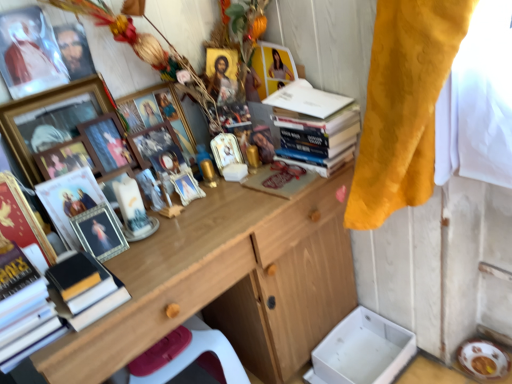
Describe the element at coordinates (280, 179) in the screenshot. I see `matte brown book at center, arranged as the first magazine when viewed from the right` at that location.

The width and height of the screenshot is (512, 384). I want to click on hardcover book at left, which is the 1th book in bottom-to-top order, so click(x=83, y=289).

How much space does metallic gold picture frame at upper left, which appears as the 7th picture frame when viewed from the right, occupy horizontally?

metallic gold picture frame at upper left, which appears as the 7th picture frame when viewed from the right, is 3.09 inches in width.

What do you see at coordinates (64, 159) in the screenshot? I see `metallic gold picture frame at upper left, which appears as the 7th picture frame when viewed from the right` at bounding box center [64, 159].

Image resolution: width=512 pixels, height=384 pixels. What do you see at coordinates (52, 118) in the screenshot?
I see `gold-framed picture at upper left, the 2th picture frame in the left-to-right sequence` at bounding box center [52, 118].

At what (x,y) coordinates should I click in order to perform the action: click on metallic gold picture frame at center, which is counted as the ninth picture frame, starting from the left. Please return your answer as a coordinate pair (x, y). Image resolution: width=512 pixels, height=384 pixels. Looking at the image, I should click on (225, 150).

Find the location of a particular element. matte gold picture frame at left, the first magazine when ordered from left to right is located at coordinates (70, 201).

Where is `matte brown book at center, the second magazine positioned from the left`? The width and height of the screenshot is (512, 384). matte brown book at center, the second magazine positioned from the left is located at coordinates (280, 179).

From a real-world perspective, does metallic gold picture frame at center, which is counted as the ninth picture frame, starting from the left, sit lower than matte brown book at center, the second magazine positioned from the left?

No.

Based on the photo, can you confirm if metallic gold picture frame at center, the first picture frame positioned from the right, is smaller than matte brown book at center, the second magazine positioned from the left?

Actually, metallic gold picture frame at center, the first picture frame positioned from the right, might be larger than matte brown book at center, the second magazine positioned from the left.

Considering the relative sizes of metallic gold picture frame at center, which is counted as the ninth picture frame, starting from the left, and matte brown book at center, arranged as the first magazine when viewed from the right, in the image provided, is metallic gold picture frame at center, which is counted as the ninth picture frame, starting from the left, taller than matte brown book at center, arranged as the first magazine when viewed from the right,?

Yes, metallic gold picture frame at center, which is counted as the ninth picture frame, starting from the left, is taller than matte brown book at center, arranged as the first magazine when viewed from the right.

Which of these two, silver metallic picture frame at center-left, the 5th picture frame when ordered from left to right, or matte brown book at center, arranged as the first magazine when viewed from the right, is smaller?

matte brown book at center, arranged as the first magazine when viewed from the right.

Considering the positions of objects silver metallic picture frame at center-left, which is counted as the fifth picture frame, starting from the right, and matte brown book at center, the second magazine positioned from the left, in the image provided, who is in front, silver metallic picture frame at center-left, which is counted as the fifth picture frame, starting from the right, or matte brown book at center, the second magazine positioned from the left,?

Positioned in front is silver metallic picture frame at center-left, which is counted as the fifth picture frame, starting from the right.

From the image's perspective, count 2nd magazines upward from the silver metallic picture frame at center-left, which is counted as the fifth picture frame, starting from the right, and point to it. Please provide its 2D coordinates.

[(280, 179)]

Is silver metallic picture frame at center-left, the 5th picture frame when ordered from left to right, not near matte brown book at center, the second magazine positioned from the left?

They are positioned close to each other.

From a real-world perspective, which is physically above, metallic gold picture frame at upper left, which is the third picture frame in left-to-right order, or matte black portrait at upper left?

matte black portrait at upper left.

Is metallic gold picture frame at upper left, which is the third picture frame in left-to-right order, behind matte black portrait at upper left?

No, metallic gold picture frame at upper left, which is the third picture frame in left-to-right order, is in front of matte black portrait at upper left.

Is metallic gold picture frame at upper left, which appears as the 7th picture frame when viewed from the right, oriented away from matte black portrait at upper left?

metallic gold picture frame at upper left, which appears as the 7th picture frame when viewed from the right, does not have its back to matte black portrait at upper left.

Between metallic gold picture frame at upper left, which is the third picture frame in left-to-right order, and matte black portrait at upper left, which one has larger size?

metallic gold picture frame at upper left, which is the third picture frame in left-to-right order.

The width and height of the screenshot is (512, 384). In order to click on person that appears on the left of matte wooden picture frame at center, marked as the 6th picture frame in a right-to-left arrangement in this screenshot , I will do `click(74, 50)`.

From a real-world perspective, is matte black portrait at upper left positioned over matte wooden picture frame at center, the 4th picture frame in the left-to-right sequence, based on gravity?

Correct, in the physical world, matte black portrait at upper left is higher than matte wooden picture frame at center, the 4th picture frame in the left-to-right sequence.

In the scene shown: Does matte black portrait at upper left have a lesser height compared to matte wooden picture frame at center, marked as the 6th picture frame in a right-to-left arrangement?

Correct, matte black portrait at upper left is not as tall as matte wooden picture frame at center, marked as the 6th picture frame in a right-to-left arrangement.

Between matte black portrait at upper left and matte wooden picture frame at center, marked as the 6th picture frame in a right-to-left arrangement, which one has larger width?

With larger width is matte wooden picture frame at center, marked as the 6th picture frame in a right-to-left arrangement.

Is matte gold picture frame at left, the first magazine when ordered from left to right, positioned beyond the bounds of metallic gold picture frame at center, the first picture frame positioned from the right?

Yes.

From the picture: Which is more to the right, matte gold picture frame at left, the first magazine when ordered from left to right, or metallic gold picture frame at center, which is counted as the ninth picture frame, starting from the left?

metallic gold picture frame at center, which is counted as the ninth picture frame, starting from the left.

Between point (71, 226) and point (230, 151), which one is positioned behind?

The point (230, 151) is more distant.

In the scene shown: Which of these two, matte gold picture frame at left, the first magazine when ordered from left to right, or metallic gold picture frame at center, which is counted as the ninth picture frame, starting from the left, stands taller?

matte gold picture frame at left, the first magazine when ordered from left to right.

From the image's perspective, relative to transparent plastic picture frame at upper left, the first picture frame from the left, is matte brown book at center, the second magazine positioned from the left, above or below?

Based on their image positions, matte brown book at center, the second magazine positioned from the left, is located beneath transparent plastic picture frame at upper left, the first picture frame from the left.

From the picture: Is matte brown book at center, the second magazine positioned from the left, wider than transparent plastic picture frame at upper left, the 9th picture frame from the right?

Correct, the width of matte brown book at center, the second magazine positioned from the left, exceeds that of transparent plastic picture frame at upper left, the 9th picture frame from the right.

How many degrees apart are the facing directions of matte brown book at center, the second magazine positioned from the left, and transparent plastic picture frame at upper left, the 9th picture frame from the right?

The angle between the facing direction of matte brown book at center, the second magazine positioned from the left, and the facing direction of transparent plastic picture frame at upper left, the 9th picture frame from the right, is 2.63 degrees.

Consider the image. Could you tell me if matte brown book at center, the second magazine positioned from the left, is turned towards transparent plastic picture frame at upper left, the 9th picture frame from the right?

No, matte brown book at center, the second magazine positioned from the left, is not oriented towards transparent plastic picture frame at upper left, the 9th picture frame from the right.

Could you tell me if transparent plastic picture frame at upper left, the first picture frame from the left, is facing matte gold picture frame at left, the first magazine when ordered from left to right?

No, transparent plastic picture frame at upper left, the first picture frame from the left, is not oriented towards matte gold picture frame at left, the first magazine when ordered from left to right.

Considering the relative sizes of transparent plastic picture frame at upper left, the 9th picture frame from the right, and matte gold picture frame at left, the first magazine when ordered from left to right, in the image provided, is transparent plastic picture frame at upper left, the 9th picture frame from the right, bigger than matte gold picture frame at left, the first magazine when ordered from left to right,?

Actually, transparent plastic picture frame at upper left, the 9th picture frame from the right, might be smaller than matte gold picture frame at left, the first magazine when ordered from left to right.

Find the location of a particular element. the 3rd picture frame counting from the left of the matte gold picture frame at left, the first magazine when ordered from left to right is located at coordinates (30, 52).

Where is `picture frame that is the 3rd object located behind the matte brown book at center, arranged as the first magazine when viewed from the right`? The image size is (512, 384). picture frame that is the 3rd object located behind the matte brown book at center, arranged as the first magazine when viewed from the right is located at coordinates (225, 150).

There is a silver metallic picture frame at center-left, which is counted as the fifth picture frame, starting from the right. Where is `the 2nd magazine above it (from the image's perspective)`? the 2nd magazine above it (from the image's perspective) is located at coordinates (280, 179).

From the image, which object appears to be farther from hardcover book at left, which is the second book in back-to-front order, hardcover books at upper right, acting as the second book starting from the left, or silver metallic picture frame at center-left, the 5th picture frame when ordered from left to right?

Among the two, hardcover books at upper right, acting as the second book starting from the left, is located further to hardcover book at left, which is the second book in back-to-front order.

Estimate the real-world distances between objects in this image. Which object is closer to hardcover book at left, which is the 1th book in bottom-to-top order, matte brown book at center, the second magazine positioned from the left, or wooden picture frame at center, which is counted as the third picture frame, starting from the right?

Based on the image, wooden picture frame at center, which is counted as the third picture frame, starting from the right, appears to be nearer to hardcover book at left, which is the 1th book in bottom-to-top order.

Based on their spatial positions, is hardcover books at upper right, the 1th book viewed from the back, or gold-framed picture at upper left, the 2th picture frame in the left-to-right sequence, further from wooden picture frame at center, the 7th picture frame when ordered from left to right?

The object further to wooden picture frame at center, the 7th picture frame when ordered from left to right, is hardcover books at upper right, the 1th book viewed from the back.

In the scene shown: From the image, which object appears to be farther from hardcover books at upper right, the 1th book viewed from the back, wooden picture frame at center, the 7th picture frame when ordered from left to right, or metallic gold picture frame at upper left, which is the third picture frame in left-to-right order?

metallic gold picture frame at upper left, which is the third picture frame in left-to-right order, is positioned further to the anchor hardcover books at upper right, the 1th book viewed from the back.

Which object lies nearer to the anchor point hardcover books at upper right, the 1th book viewed from the back, metallic gold picture frame at upper left, which is the third picture frame in left-to-right order, or matte wooden picture frame at center, marked as the 6th picture frame in a right-to-left arrangement?

matte wooden picture frame at center, marked as the 6th picture frame in a right-to-left arrangement, is closer to hardcover books at upper right, the 1th book viewed from the back.

Considering their positions, is wooden desk at center positioned closer to metallic gold picture frame at upper left, which appears as the 7th picture frame when viewed from the right, than gold-framed picture at upper left, which is the 8th picture frame in right-to-left order?

gold-framed picture at upper left, which is the 8th picture frame in right-to-left order, lies closer to metallic gold picture frame at upper left, which appears as the 7th picture frame when viewed from the right, than the other object.

When comparing their distances from matte gold picture frame at left, positioned as the 2th magazine in right-to-left order, does hardcover book at left, the 1th book in the front-to-back sequence, or matte wooden picture frame at center, the 4th picture frame in the left-to-right sequence, seem further?

Based on the image, matte wooden picture frame at center, the 4th picture frame in the left-to-right sequence, appears to be further to matte gold picture frame at left, positioned as the 2th magazine in right-to-left order.

Based on their spatial positions, is wooden desk at center or transparent plastic picture frame at upper left, the first picture frame from the left, closer to wooden picture frame at center, which is counted as the third picture frame, starting from the right?

transparent plastic picture frame at upper left, the first picture frame from the left.

This screenshot has height=384, width=512. Identify the location of book between matte black portrait at upper left and hardcover books at upper right, acting as the second book starting from the left. (83, 289).

The height and width of the screenshot is (384, 512). What are the coordinates of `person situated between gold-framed picture at upper left, which is the 8th picture frame in right-to-left order, and metallic gold picture frame at center, the first picture frame positioned from the right, from left to right` in the screenshot? It's located at click(74, 50).

Locate an element on the screen. The image size is (512, 384). desk between gold-framed picture at upper left, which is the 8th picture frame in right-to-left order, and hardcover books at upper right, the 1th book viewed from the back, from left to right is located at coordinates (225, 284).

In order to click on magazine between metallic gold picture frame at upper left, which is the third picture frame in left-to-right order, and wooden picture frame at center, which is the eighth picture frame from left to right, in the horizontal direction in this screenshot , I will do click(x=70, y=201).